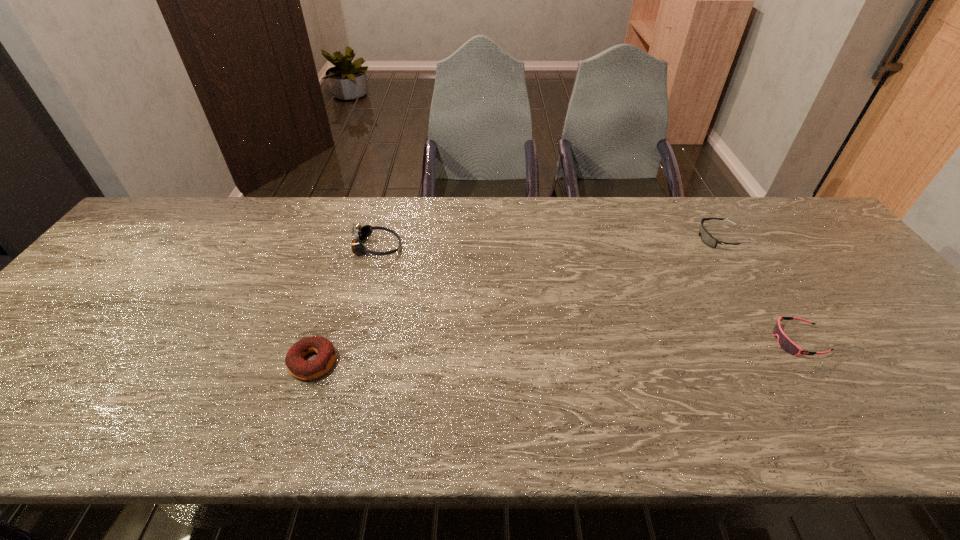
This screenshot has height=540, width=960. Identify the location of free spot at the left edge of the desktop. coord(70,327).

At what (x,y) coordinates should I click in order to perform the action: click on vacant space at the right edge. Please return your answer as a coordinate pair (x, y). This screenshot has height=540, width=960. Looking at the image, I should click on (838, 289).

Find the location of a particular element. The image size is (960, 540). vacant space at the far right corner of the desktop is located at coordinates (803, 239).

This screenshot has height=540, width=960. What are the coordinates of `empty location between the shortest goggles and the doughnut` in the screenshot? It's located at (555, 352).

Find the location of a particular element. vacant space in between the tallest object and the doughnut is located at coordinates (345, 305).

At what (x,y) coordinates should I click in order to perform the action: click on empty space between the doughnut and the tallest object. Please return your answer as a coordinate pair (x, y). The height and width of the screenshot is (540, 960). Looking at the image, I should click on (345, 305).

You are a GUI agent. You are given a task and a screenshot of the screen. Output one action in this format:
    pyautogui.click(x=<x>, y=<y>)
    Task: Click on the free space between the nearest goggles and the tallest goggles
    The image size is (960, 540).
    Given the screenshot: What is the action you would take?
    pyautogui.click(x=587, y=294)

Image resolution: width=960 pixels, height=540 pixels. I want to click on blank region between the tallest goggles and the shortest goggles, so click(x=587, y=294).

The width and height of the screenshot is (960, 540). Find the location of `vacant space that's between the doughnut and the tallest object`. vacant space that's between the doughnut and the tallest object is located at coordinates pos(345,305).

Where is `free spot between the tallest object and the nearest goggles`? This screenshot has height=540, width=960. free spot between the tallest object and the nearest goggles is located at coordinates (587, 294).